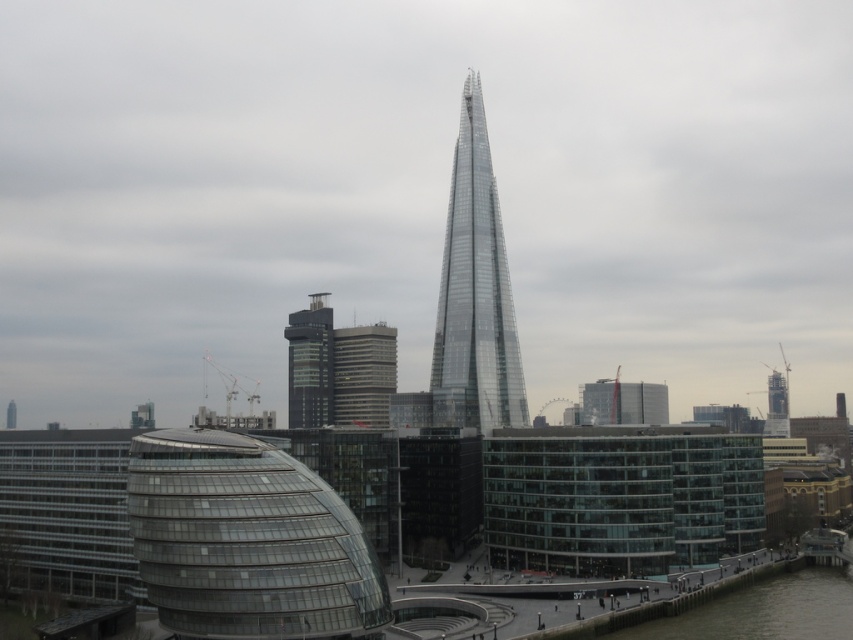
You are a tourist standing in the city square and want to take a photo of both the transparent glass tower at center and the matte glass building at center. Which one should you focus on first to ensure both are in clear view?

You should focus on the transparent glass tower at center first since it is closer to you than the matte glass building at center. By focusing on the closer object, both will be in focus as the matte glass building at center is further away but still within the depth of field.

You are a city planner reviewing a 3D model of the city. You notice a point marked at coordinates (363, 374). Based on the scene, can you determine which building this point is located on?

The point at coordinates (363, 374) is on the matte glass building at center.